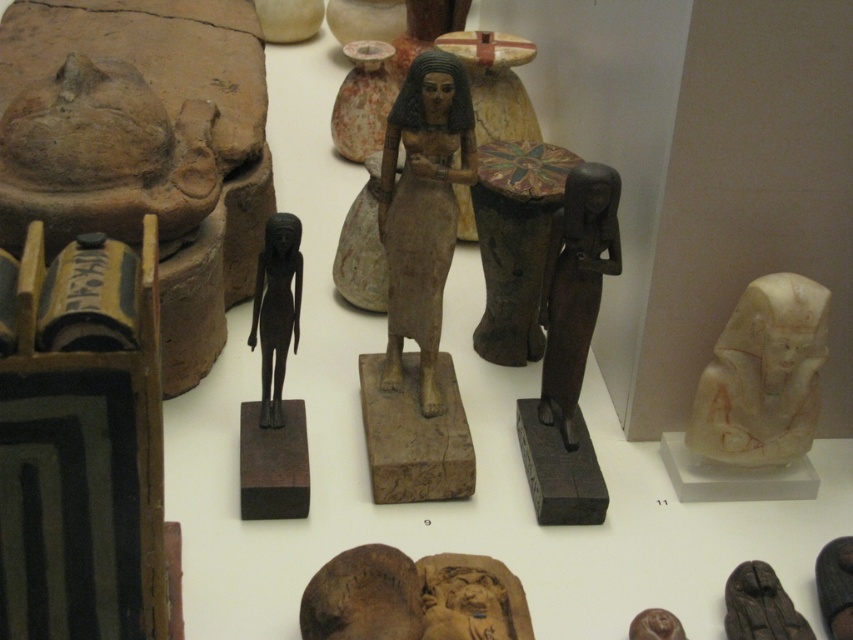
Measure the distance between black polished statue at center-left and camera.

They are 1.65 meters apart.

Who is more forward, [294,240] or [788,625]?

Point [788,625]

You are a GUI agent. You are given a task and a screenshot of the screen. Output one action in this format:
    pyautogui.click(x=<x>, y=<y>)
    Task: Click on the black polished statue at center-left
    This screenshot has height=640, width=853.
    Given the screenshot: What is the action you would take?
    [276, 308]

Is matte brown statue at center further to the viewer compared to black wood statue at lower right?

Yes, matte brown statue at center is behind black wood statue at lower right.

Who is more distant from viewer, (428,205) or (804,618)?

Positioned behind is point (428,205).

This screenshot has height=640, width=853. I want to click on matte brown statue at center, so coord(422,209).

Is white marble head at right positioned at the back of black polished statue at center-left?

No.

Is white marble head at right in front of black polished statue at center-left?

Yes, white marble head at right is in front of black polished statue at center-left.

The height and width of the screenshot is (640, 853). In order to click on white marble head at right in this screenshot , I will do `click(763, 376)`.